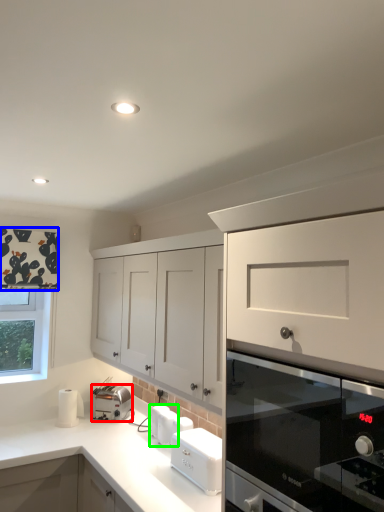
Question: Which is nearer to the kitchen appliance (highlighted by a red box)? curtain (highlighted by a blue box) or appliance (highlighted by a green box).

Choices:
 (A) curtain
 (B) appliance

Answer: (B)